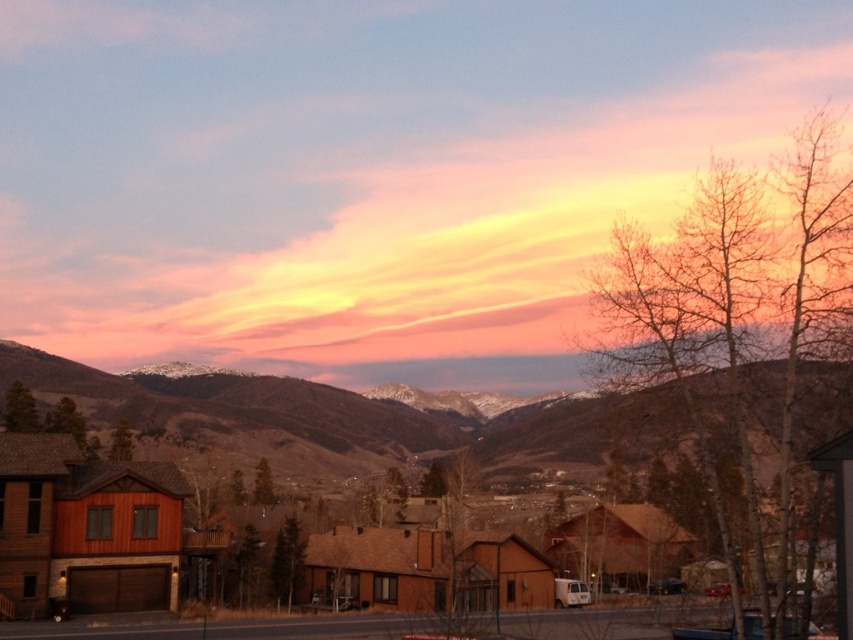
Is point (97, 420) positioned behind point (57, 545)?

Yes, point (97, 420) is farther from viewer.

Is snow-covered mountain range at center to the left of wooden cabin at lower left from the viewer's perspective?

Yes, snow-covered mountain range at center is to the left of wooden cabin at lower left.

Where is `snow-covered mountain range at center`? snow-covered mountain range at center is located at coordinates (349, 420).

You are a GUI agent. You are given a task and a screenshot of the screen. Output one action in this format:
    pyautogui.click(x=<x>, y=<y>)
    Task: Click on the snow-covered mountain range at center
    This screenshot has width=853, height=640.
    Given the screenshot: What is the action you would take?
    pyautogui.click(x=349, y=420)